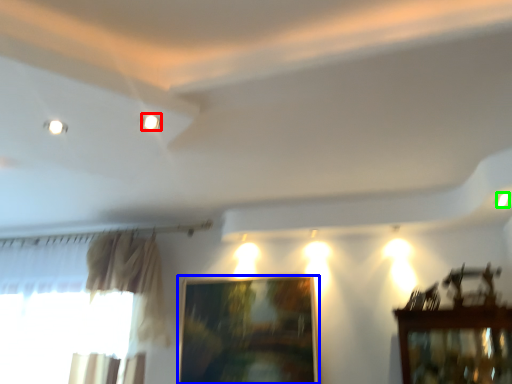
Question: Estimate the real-world distances between objects in this image. Which object is farther from lighting (highlighted by a red box), picture frame (highlighted by a blue box) or light (highlighted by a green box)?

Choices:
 (A) picture frame
 (B) light

Answer: (A)